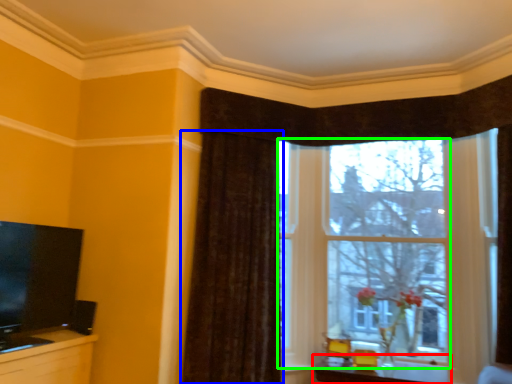
Question: Considering the real-world distances, which object is farthest from table (highlighted by a red box)? curtain (highlighted by a blue box) or window (highlighted by a green box)?

Choices:
 (A) curtain
 (B) window

Answer: (A)